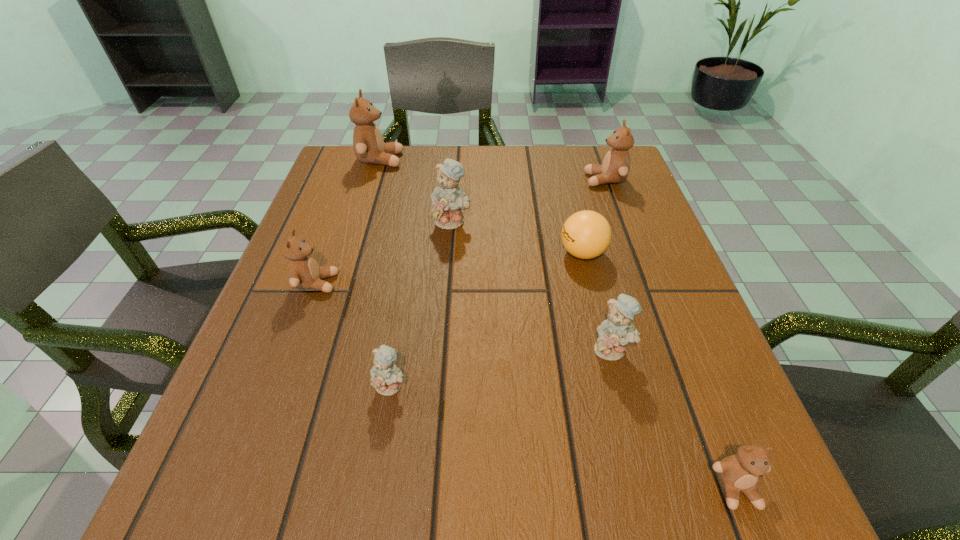
The height and width of the screenshot is (540, 960). In the image, there is a desktop. In order to click on blank space at the far edge in this screenshot , I will do `click(390, 177)`.

This screenshot has width=960, height=540. Find the location of `vacant space at the near edge of the desktop`. vacant space at the near edge of the desktop is located at coordinates (503, 522).

Where is `vacant region at the left edge of the desktop`? The height and width of the screenshot is (540, 960). vacant region at the left edge of the desktop is located at coordinates (255, 417).

Where is `vacant space at the right edge of the desktop`? This screenshot has height=540, width=960. vacant space at the right edge of the desktop is located at coordinates (612, 216).

In the image, there is a desktop. Find the location of `vacant space at the near left corner`. vacant space at the near left corner is located at coordinates (196, 464).

Locate an element on the screen. free space between the ping-pong ball and the biggest brown teddy bear is located at coordinates [x=481, y=206].

The width and height of the screenshot is (960, 540). Find the location of `unoccupied position between the second nearest blue teddy bear and the tallest teddy bear`. unoccupied position between the second nearest blue teddy bear and the tallest teddy bear is located at coordinates (496, 255).

What are the coordinates of `free area in between the fifth teddy bear from left to right and the second blue teddy bear from left to right` in the screenshot? It's located at (532, 286).

You are a GUI agent. You are given a task and a screenshot of the screen. Output one action in this format:
    pyautogui.click(x=<x>, y=<y>)
    Task: Click on the free space that is in between the second nearest object and the ping-pong ball
    The width and height of the screenshot is (960, 540).
    Given the screenshot: What is the action you would take?
    pyautogui.click(x=487, y=320)

The height and width of the screenshot is (540, 960). In order to click on free space between the tallest object and the farthest blue teddy bear in this screenshot , I will do `click(417, 191)`.